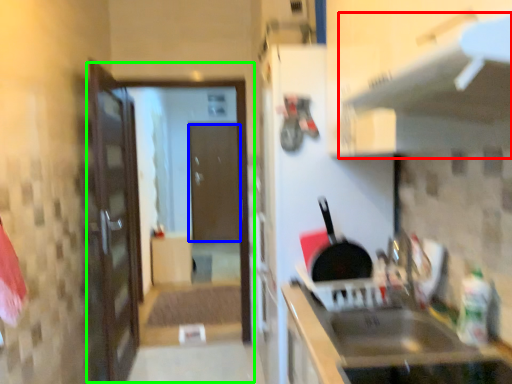
Question: Which object is the closest to the exhaust hood (highlighted by a red box)? Choose among these: door (highlighted by a blue box) or screen door (highlighted by a green box).

Choices:
 (A) door
 (B) screen door

Answer: (B)